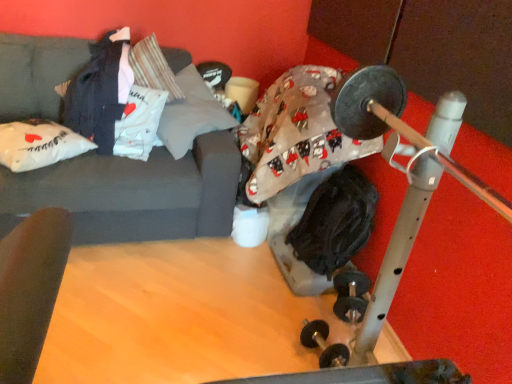
Question: Can you confirm if dark gray fabric couch at upper left is taller than dark gray fabric at upper left, arranged as the 1th clothing when viewed from the left?

Choices:
 (A) no
 (B) yes

Answer: (B)

Question: Can you confirm if dark gray fabric couch at upper left is bigger than dark gray fabric at upper left, the 2th clothing viewed from the right?

Choices:
 (A) no
 (B) yes

Answer: (B)

Question: Can you confirm if dark gray fabric couch at upper left is smaller than dark gray fabric at upper left, arranged as the 1th clothing when viewed from the left?

Choices:
 (A) yes
 (B) no

Answer: (B)

Question: Would you say dark gray fabric couch at upper left is a long distance from dark gray fabric at upper left, which ranks as the 2th clothing in bottom-to-top order?

Choices:
 (A) no
 (B) yes

Answer: (A)

Question: From the image's perspective, does dark gray fabric couch at upper left appear lower than dark gray fabric at upper left, the 2th clothing viewed from the right?

Choices:
 (A) no
 (B) yes

Answer: (B)

Question: From a real-world perspective, is dark gray fabric couch at upper left below dark gray fabric at upper left, which ranks as the 2th clothing in bottom-to-top order?

Choices:
 (A) no
 (B) yes

Answer: (B)

Question: Can you confirm if black fabric at center, the 2th clothing in the top-to-bottom sequence, is positioned to the left of dark gray fabric at upper left, arranged as the 1th clothing when viewed from the left?

Choices:
 (A) no
 (B) yes

Answer: (A)

Question: Is there a large distance between black fabric at center, which is counted as the first clothing, starting from the right, and dark gray fabric at upper left, the 2th clothing viewed from the right?

Choices:
 (A) yes
 (B) no

Answer: (A)

Question: Is black fabric at center, the 2th clothing in the top-to-bottom sequence, beside dark gray fabric at upper left, arranged as the 1th clothing when viewed from the left?

Choices:
 (A) yes
 (B) no

Answer: (B)

Question: Is black fabric at center, which is the second clothing from left to right, facing away from dark gray fabric at upper left, the first clothing positioned from the top?

Choices:
 (A) no
 (B) yes

Answer: (A)

Question: Is black fabric at center, acting as the first clothing starting from the bottom, surrounding dark gray fabric at upper left, which ranks as the 2th clothing in bottom-to-top order?

Choices:
 (A) yes
 (B) no

Answer: (B)

Question: Considering the relative sizes of black fabric at center, which is counted as the first clothing, starting from the right, and dark gray fabric at upper left, arranged as the 1th clothing when viewed from the left, in the image provided, is black fabric at center, which is counted as the first clothing, starting from the right, smaller than dark gray fabric at upper left, arranged as the 1th clothing when viewed from the left,?

Choices:
 (A) no
 (B) yes

Answer: (B)

Question: Is black fabric at center, acting as the first clothing starting from the bottom, not close to gray fabric pillow at upper center, positioned as the second pillow in left-to-right order?

Choices:
 (A) no
 (B) yes

Answer: (A)